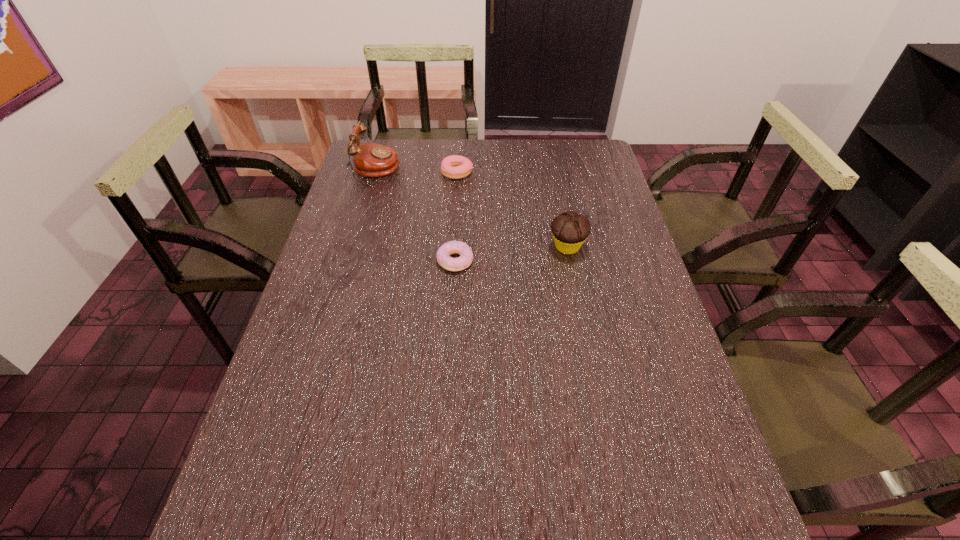
Locate an element on the screen. The width and height of the screenshot is (960, 540). object that stands as the closest to the third shortest object is located at coordinates (443, 254).

This screenshot has height=540, width=960. Find the location of `vacant space that satisfies the following two spatial constraints: 1. on the dial of the tallest object; 2. on the right side of the second tallest object`. vacant space that satisfies the following two spatial constraints: 1. on the dial of the tallest object; 2. on the right side of the second tallest object is located at coordinates (353, 247).

Identify the location of vacant space that satisfies the following two spatial constraints: 1. on the dial of the nearer doughnut; 2. on the left side of the tallest object. This screenshot has width=960, height=540. (348, 261).

At what (x,y) coordinates should I click in order to perform the action: click on free space that satisfies the following two spatial constraints: 1. on the dial of the leftmost object; 2. on the right side of the nearer doughnut. Please return your answer as a coordinate pair (x, y). Image resolution: width=960 pixels, height=540 pixels. Looking at the image, I should click on point(348,261).

Locate an element on the screen. vacant position in the image that satisfies the following two spatial constraints: 1. on the dial of the telephone; 2. on the back side of the farther doughnut is located at coordinates (375, 172).

Image resolution: width=960 pixels, height=540 pixels. I want to click on vacant space that satisfies the following two spatial constraints: 1. on the back side of the nearer doughnut; 2. on the dial of the tallest object, so click(x=460, y=170).

The width and height of the screenshot is (960, 540). In order to click on vacant area that satisfies the following two spatial constraints: 1. on the dial of the nearer doughnut; 2. on the right side of the telephone in this screenshot , I will do `click(348, 261)`.

Where is `vacant area that satisfies the following two spatial constraints: 1. on the dial of the leftmost object; 2. on the back side of the farther doughnut`? The width and height of the screenshot is (960, 540). vacant area that satisfies the following two spatial constraints: 1. on the dial of the leftmost object; 2. on the back side of the farther doughnut is located at coordinates (375, 172).